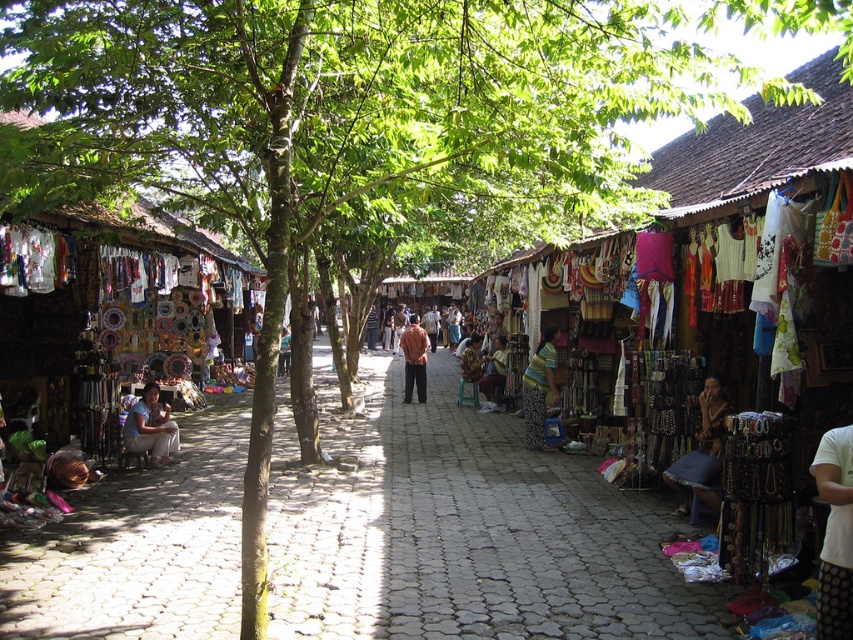
Can you confirm if matte brown shirt at center is positioned above matte brown leather bag at center?

Yes, matte brown shirt at center is above matte brown leather bag at center.

Which of these two, matte brown shirt at center or matte brown leather bag at center, stands taller?

matte brown shirt at center

Where is `matte brown shirt at center`? matte brown shirt at center is located at coordinates (415, 358).

Locate an element on the screen. matte brown shirt at center is located at coordinates (415, 358).

Measure the distance between blue fabric skirt at lower right and matte brown shirt at center.

A distance of 36.91 feet exists between blue fabric skirt at lower right and matte brown shirt at center.

Does blue fabric skirt at lower right have a smaller size compared to matte brown shirt at center?

Yes, blue fabric skirt at lower right is smaller than matte brown shirt at center.

What do you see at coordinates (701, 451) in the screenshot? I see `blue fabric skirt at lower right` at bounding box center [701, 451].

Identify the location of blue fabric skirt at lower right. (701, 451).

Measure the distance between white cotton shirt at lower right and matte white fabric at center.

They are 9.25 meters apart.

Can you confirm if white cotton shirt at lower right is wider than matte white fabric at center?

No.

The width and height of the screenshot is (853, 640). Identify the location of white cotton shirt at lower right. (834, 532).